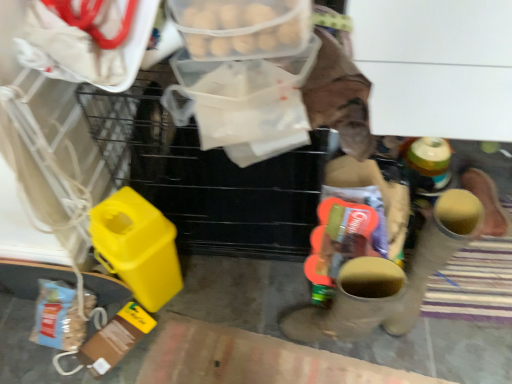
Question: From a real-world perspective, is translucent plastic container at upper center over matte brown boot at center, which appears as the second footwear when viewed from the right?

Choices:
 (A) yes
 (B) no

Answer: (A)

Question: Considering the relative sizes of translucent plastic container at upper center and matte brown boot at center, which appears as the second footwear when viewed from the right, in the image provided, is translucent plastic container at upper center smaller than matte brown boot at center, which appears as the second footwear when viewed from the right,?

Choices:
 (A) no
 (B) yes

Answer: (B)

Question: Is translucent plastic container at upper center to the right of matte brown boot at center, which appears as the second footwear when viewed from the right, from the viewer's perspective?

Choices:
 (A) no
 (B) yes

Answer: (A)

Question: Would you consider translucent plastic container at upper center to be distant from matte brown boot at center, which appears as the second footwear when viewed from the right?

Choices:
 (A) yes
 (B) no

Answer: (B)

Question: Is translucent plastic container at upper center thinner than matte brown boot at center, positioned as the first footwear in left-to-right order?

Choices:
 (A) yes
 (B) no

Answer: (A)

Question: Considering the positions of translucent plastic container at upper center and rubber yellow boot at right, which is the 1th footwear in right-to-left order, in the image, is translucent plastic container at upper center bigger or smaller than rubber yellow boot at right, which is the 1th footwear in right-to-left order,?

Choices:
 (A) small
 (B) big

Answer: (A)

Question: Would you say translucent plastic container at upper center is inside or outside rubber yellow boot at right, which is the 1th footwear in right-to-left order?

Choices:
 (A) outside
 (B) inside

Answer: (A)

Question: From their relative heights in the image, would you say translucent plastic container at upper center is taller or shorter than rubber yellow boot at right, which is the 1th footwear in right-to-left order?

Choices:
 (A) short
 (B) tall

Answer: (A)

Question: Based on their positions, is translucent plastic container at upper center located to the left or right of rubber yellow boot at right, which is the 1th footwear in right-to-left order?

Choices:
 (A) left
 (B) right

Answer: (A)

Question: Is matte brown boot at center, which appears as the second footwear when viewed from the right, situated inside rubber yellow boot at right, the second footwear in the left-to-right sequence, or outside?

Choices:
 (A) outside
 (B) inside

Answer: (A)

Question: Is matte brown boot at center, which appears as the second footwear when viewed from the right, in front of or behind rubber yellow boot at right, which is the 1th footwear in right-to-left order, in the image?

Choices:
 (A) front
 (B) behind

Answer: (A)

Question: From the image's perspective, is matte brown boot at center, positioned as the first footwear in left-to-right order, positioned above or below rubber yellow boot at right, which is the 1th footwear in right-to-left order?

Choices:
 (A) above
 (B) below

Answer: (B)

Question: Is matte brown boot at center, positioned as the first footwear in left-to-right order, taller or shorter than rubber yellow boot at right, the second footwear in the left-to-right sequence?

Choices:
 (A) tall
 (B) short

Answer: (B)

Question: Considering the positions of point (376, 276) and point (301, 26), is point (376, 276) closer or farther from the camera than point (301, 26)?

Choices:
 (A) closer
 (B) farther

Answer: (B)

Question: Is matte brown boot at center, which appears as the second footwear when viewed from the right, taller or shorter than translucent plastic container at upper center?

Choices:
 (A) tall
 (B) short

Answer: (A)